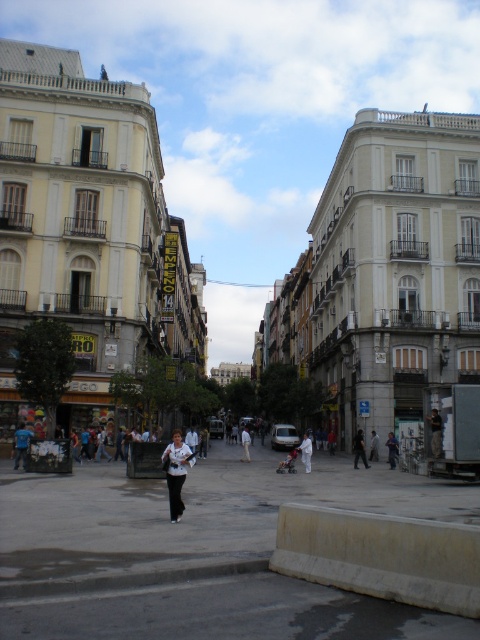
You are standing on the sidewalk in this European city scene. You see a dark gray fabric jacket at lower right and a black fabric person at center. Which object is positioned to the right of the other?

The dark gray fabric jacket at lower right is positioned to the right of the black fabric person at center.

You are a photographer standing on the street and want to take a photo of the black fabric person at center and the white cotton pants at center. Which one should you focus on to ensure the other is also in focus?

You should focus on the black fabric person at center since it is in front of the white cotton pants at center, so focusing on the closer object will keep both in focus.

You are a delivery person needing to cross the street to deliver a package to the black fabric person at center and the white cotton pants at center. The street is 15 meters wide. Can you safely cross the street without getting wet from the puddles?

The black fabric person at center and white cotton pants at center are 16.11 meters apart, so the distance between them is greater than the street width of 15 meters. Therefore, you cannot safely cross the street to reach both of them without getting wet from the puddles.